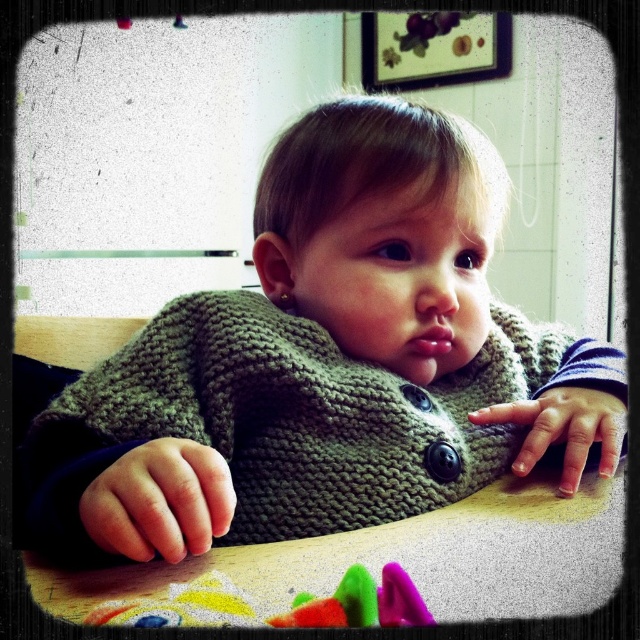
You are a parent trying to choose an item to pack for a trip. You have the knitted green sweater at center and the rubberized plastic toy at lower center in front of you. Which item takes up more space?

The knitted green sweater at center is larger in size than the rubberized plastic toy at lower center, so it takes up more space.

You are standing in the room and see two points marked on the wall behind the child. The first point is at coordinates point (x=424, y=528) and the second is at point (x=403, y=582). Which point is closer to you?

Point (x=424, y=528) is closer to you because it is further to the viewer than point (x=403, y=582).